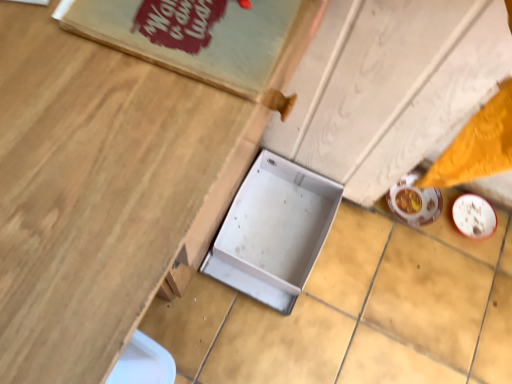
Question: From a real-world perspective, is metallic silver box at center beneath metallic silver tray at center?

Choices:
 (A) no
 (B) yes

Answer: (B)

Question: Is metallic silver box at center further to camera compared to metallic silver tray at center?

Choices:
 (A) yes
 (B) no

Answer: (A)

Question: Is metallic silver box at center closer to camera compared to metallic silver tray at center?

Choices:
 (A) yes
 (B) no

Answer: (B)

Question: Does metallic silver box at center have a greater height compared to metallic silver tray at center?

Choices:
 (A) no
 (B) yes

Answer: (A)

Question: Is metallic silver box at center placed right next to metallic silver tray at center?

Choices:
 (A) no
 (B) yes

Answer: (A)

Question: Could you tell me if metallic silver box at center is turned towards metallic silver tray at center?

Choices:
 (A) no
 (B) yes

Answer: (A)

Question: From a real-world perspective, is metallic silver tray at center on top of metallic silver box at center?

Choices:
 (A) yes
 (B) no

Answer: (A)

Question: Is metallic silver tray at center positioned beyond the bounds of metallic silver box at center?

Choices:
 (A) no
 (B) yes

Answer: (B)

Question: From the image's perspective, is metallic silver tray at center on metallic silver box at center?

Choices:
 (A) no
 (B) yes

Answer: (B)

Question: Are metallic silver tray at center and metallic silver box at center far apart?

Choices:
 (A) no
 (B) yes

Answer: (A)

Question: From the image's perspective, is metallic silver tray at center below metallic silver box at center?

Choices:
 (A) no
 (B) yes

Answer: (A)

Question: Considering the relative sizes of metallic silver tray at center and metallic silver box at center in the image provided, is metallic silver tray at center bigger than metallic silver box at center?

Choices:
 (A) yes
 (B) no

Answer: (A)

Question: In terms of size, does metallic silver box at center appear bigger or smaller than metallic silver tray at center?

Choices:
 (A) big
 (B) small

Answer: (B)